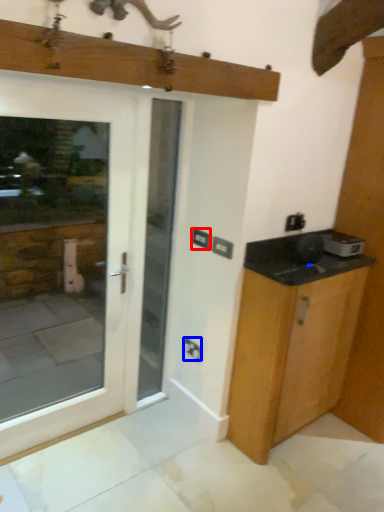
Question: Among these objects, which one is nearest to the camera, electric outlet (highlighted by a red box) or electric outlet (highlighted by a blue box)?

Choices:
 (A) electric outlet
 (B) electric outlet

Answer: (A)